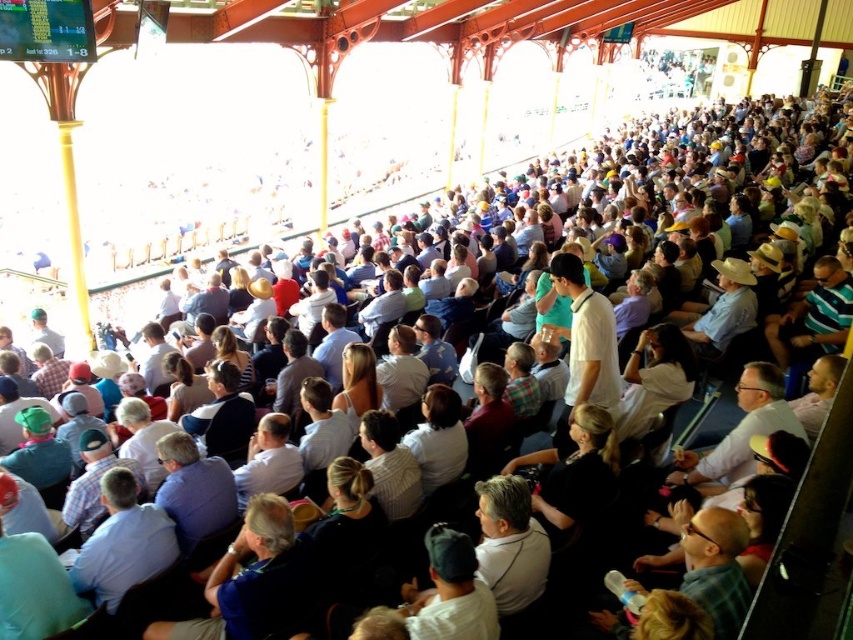
Question: Which of the following is the closest to the observer?

Choices:
 (A) light blue shirt at center
 (B) white shirt at center

Answer: (A)

Question: Observing the image, what is the correct spatial positioning of blue shirt at center in reference to light brown hair at center?

Choices:
 (A) below
 (B) above

Answer: (A)

Question: Among these points, which one is nearest to the camera?

Choices:
 (A) (372, 416)
 (B) (158, 547)
 (C) (387, 378)

Answer: (B)

Question: Based on their relative distances, which object is farther from the blue shirt at center?

Choices:
 (A) light brown hair at center
 (B) white shirt at center
 (C) light blue shirt at center

Answer: (A)

Question: Considering the relative positions of light brown hair at center and white shirt at center in the image provided, where is light brown hair at center located with respect to white shirt at center?

Choices:
 (A) below
 (B) above

Answer: (B)

Question: Is light blue shirt at center closer to the viewer compared to light gray shirt at center?

Choices:
 (A) no
 (B) yes

Answer: (B)